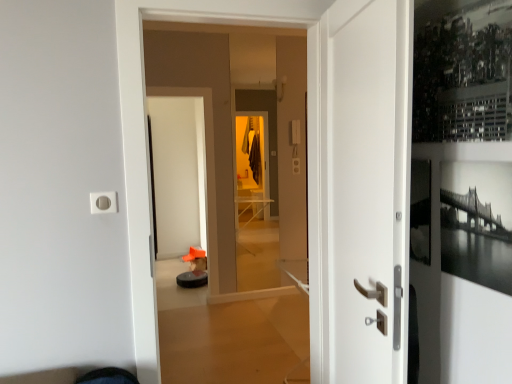
Question: Would you say white glossy door at center, which is the 1th door from left to right, is inside or outside white matte door at center, which appears as the 1th door when viewed from the right?

Choices:
 (A) outside
 (B) inside

Answer: (A)

Question: Considering their positions, is white glossy door at center, which is the 1th door from left to right, located in front of or behind white matte door at center, which appears as the 1th door when viewed from the right?

Choices:
 (A) front
 (B) behind

Answer: (B)

Question: Which is nearer to the black plastic robot vacuum cleaner at lower center?

Choices:
 (A) black glossy screen door at center
 (B) white glossy door at center, which is the 1th door from left to right
 (C) white matte door at center, positioned as the second door in left-to-right order

Answer: (A)

Question: Estimate the real-world distances between objects in this image. Which object is farther from the black glossy screen door at center?

Choices:
 (A) white matte door at center, which appears as the 1th door when viewed from the right
 (B) black plastic robot vacuum cleaner at lower center
 (C) white glossy door at center, which is the 1th door from left to right

Answer: (A)